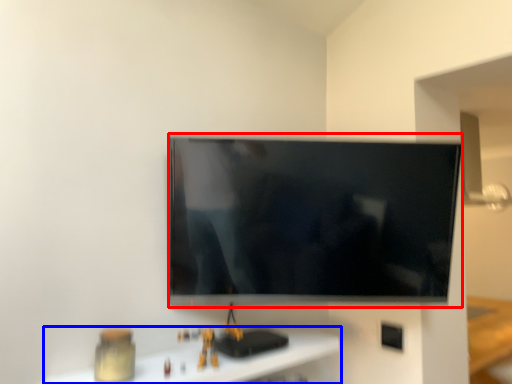
Question: Which object is further to the camera taking this photo, television (highlighted by a red box) or furniture (highlighted by a blue box)?

Choices:
 (A) television
 (B) furniture

Answer: (A)